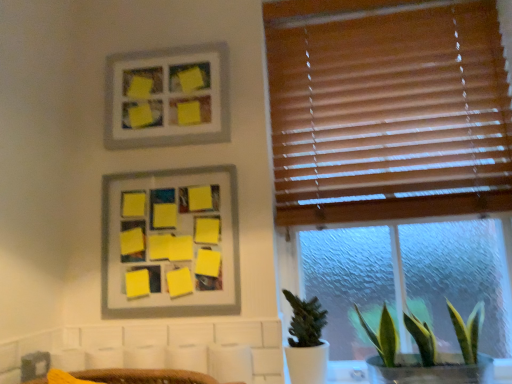
Question: From the image's perspective, is green matte plant at lower right, which appears as the first houseplant when viewed from the left, on top of yellow matte board at upper center, which is the first picture frame in bottom-to-top order?

Choices:
 (A) no
 (B) yes

Answer: (A)

Question: Is green matte plant at lower right, which appears as the first houseplant when viewed from the left, positioned before yellow matte board at upper center, which is the first picture frame in bottom-to-top order?

Choices:
 (A) yes
 (B) no

Answer: (A)

Question: Are green matte plant at lower right, which appears as the first houseplant when viewed from the left, and yellow matte board at upper center, which is the first picture frame in bottom-to-top order, beside each other?

Choices:
 (A) yes
 (B) no

Answer: (B)

Question: From the image's perspective, is green matte plant at lower right, which appears as the first houseplant when viewed from the left, located beneath yellow matte board at upper center, which is the first picture frame in bottom-to-top order?

Choices:
 (A) no
 (B) yes

Answer: (B)

Question: From a real-world perspective, is green matte plant at lower right, which is the second houseplant in right-to-left order, on yellow matte board at upper center, which is the first picture frame in bottom-to-top order?

Choices:
 (A) yes
 (B) no

Answer: (B)

Question: Can you confirm if green matte plant at lower right, which appears as the first houseplant when viewed from the left, is bigger than yellow matte board at upper center, which is the first picture frame in bottom-to-top order?

Choices:
 (A) no
 (B) yes

Answer: (A)

Question: Is yellow matte picture frame at upper center, the first picture frame from the top, oriented towards green leafy plant at lower right, the second houseplant when ordered from left to right?

Choices:
 (A) yes
 (B) no

Answer: (B)

Question: Can we say yellow matte picture frame at upper center, which is the 2th picture frame from bottom to top, lies outside green leafy plant at lower right, the second houseplant when ordered from left to right?

Choices:
 (A) yes
 (B) no

Answer: (A)

Question: Can you confirm if yellow matte picture frame at upper center, which is the 2th picture frame from bottom to top, is wider than green leafy plant at lower right, which ranks as the 1th houseplant in right-to-left order?

Choices:
 (A) yes
 (B) no

Answer: (B)

Question: Is yellow matte picture frame at upper center, which is the 2th picture frame from bottom to top, smaller than green leafy plant at lower right, which ranks as the 1th houseplant in right-to-left order?

Choices:
 (A) yes
 (B) no

Answer: (A)

Question: Is yellow matte picture frame at upper center, which is the 2th picture frame from bottom to top, shorter than green leafy plant at lower right, which ranks as the 1th houseplant in right-to-left order?

Choices:
 (A) no
 (B) yes

Answer: (A)

Question: From a real-world perspective, is yellow matte picture frame at upper center, which is the 2th picture frame from bottom to top, physically below green leafy plant at lower right, the second houseplant when ordered from left to right?

Choices:
 (A) yes
 (B) no

Answer: (B)

Question: Is green leafy plant at lower right, which ranks as the 1th houseplant in right-to-left order, taller than yellow matte board at upper center, which is the first picture frame in bottom-to-top order?

Choices:
 (A) no
 (B) yes

Answer: (A)